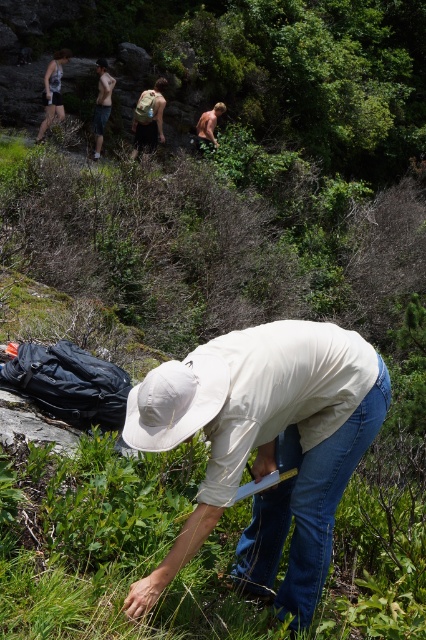
Question: Among these objects, which one is nearest to the camera?

Choices:
 (A) silver metallic tank top at upper left
 (B) tan skin torso at upper center
 (C) light brown fur dog at upper center

Answer: (A)

Question: Is white cotton hat at center to the right of brown hairy man at upper center from the viewer's perspective?

Choices:
 (A) yes
 (B) no

Answer: (A)

Question: Is white cotton hat at center below light brown fur dog at upper center?

Choices:
 (A) yes
 (B) no

Answer: (A)

Question: Does white cotton hat at center have a larger size compared to light brown fur dog at upper center?

Choices:
 (A) no
 (B) yes

Answer: (B)

Question: Which point is closer to the camera taking this photo?

Choices:
 (A) (279, 356)
 (B) (57, 77)
 (C) (198, 120)

Answer: (A)

Question: Which is farther from the silver metallic tank top at upper left?

Choices:
 (A) light brown fur dog at upper center
 (B) tan skin torso at upper center
 (C) white cotton hat at center

Answer: (C)